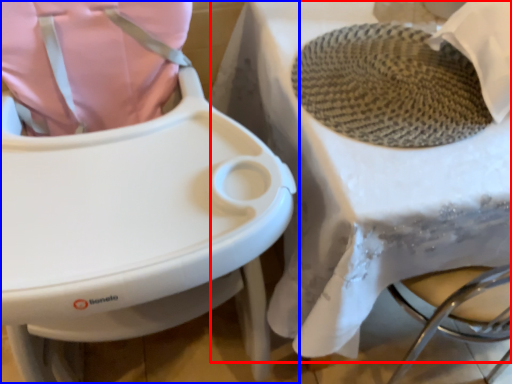
Question: Which object appears closest to the camera in this image, table (highlighted by a red box) or toilet (highlighted by a blue box)?

Choices:
 (A) table
 (B) toilet

Answer: (B)